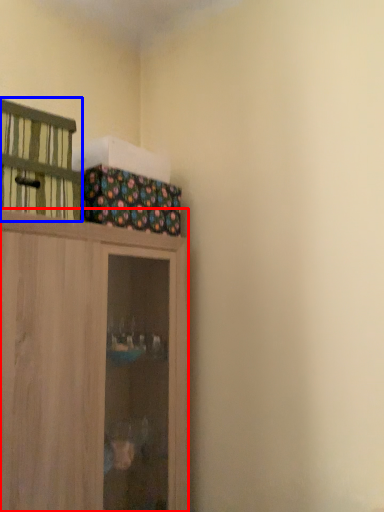
Question: Among these objects, which one is nearest to the camera, cupboard (highlighted by a red box) or cabinetry (highlighted by a blue box)?

Choices:
 (A) cupboard
 (B) cabinetry

Answer: (A)